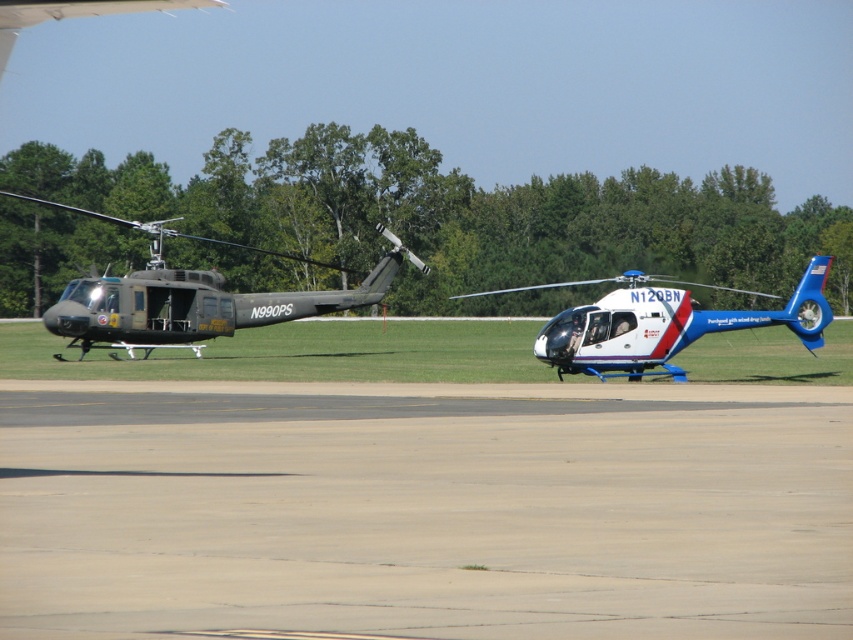
You are a pilot planning to land a helicopter on the smooth concrete runway at center. The runway is at point 0.798, 0.499. Where should you aim your helicopter to land safely?

You should aim your helicopter to land at the position of the smooth concrete runway at center, which is located at point (425, 509).

Looking at this image, you are a pilot standing at the edge of the tarmac where the white glossy helicopter at center is parked. You need to walk to the matte black helicopter at left. Which direction should you walk?

You should walk to the left because the matte black helicopter at left is positioned to the left of the white glossy helicopter at center.

You are a pilot trying to land a small drone on the smooth concrete runway at center. The drone requires a landing area that is wider than the white glossy helicopter at center. Can the runway accommodate the drone?

The smooth concrete runway at center is thinner than the white glossy helicopter at center, so it cannot accommodate the drone as it is narrower than the required width.